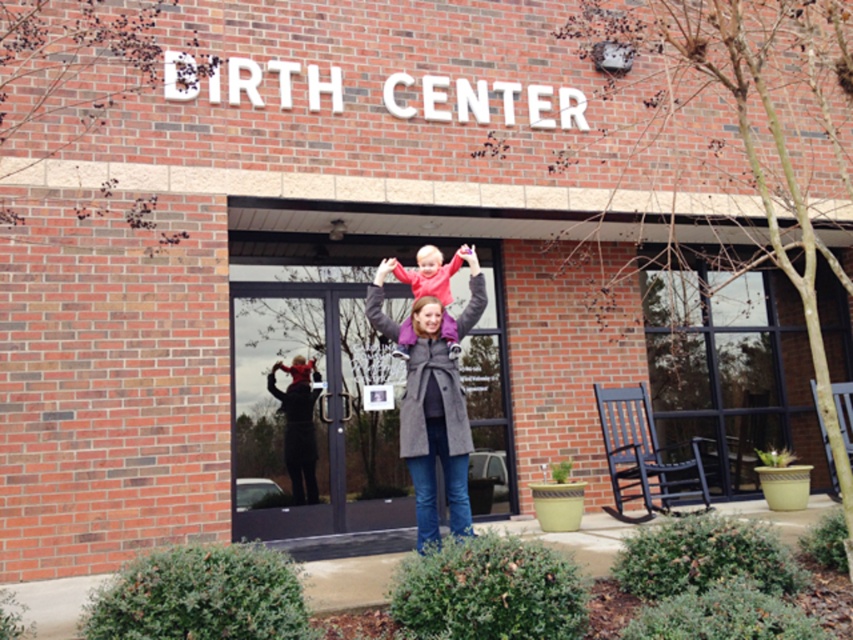
You are standing at the entrance of the building and want to find the woman wearing the matte gray coat at center. Which direction should you look to find her?

The matte gray coat at center is located at point (x=434, y=426), which is to the right side of the entrance. You should look to your right to find the woman wearing the matte gray coat at center.

You are a photographer trying to capture a photo of the matte pink sweater at center without the matte gray coat at center blocking it. What should you do?

The matte gray coat at center is in front of the matte pink sweater at center, so you should move the matte gray coat at center out of the way or adjust your angle to avoid it blocking the view of the matte pink sweater at center.